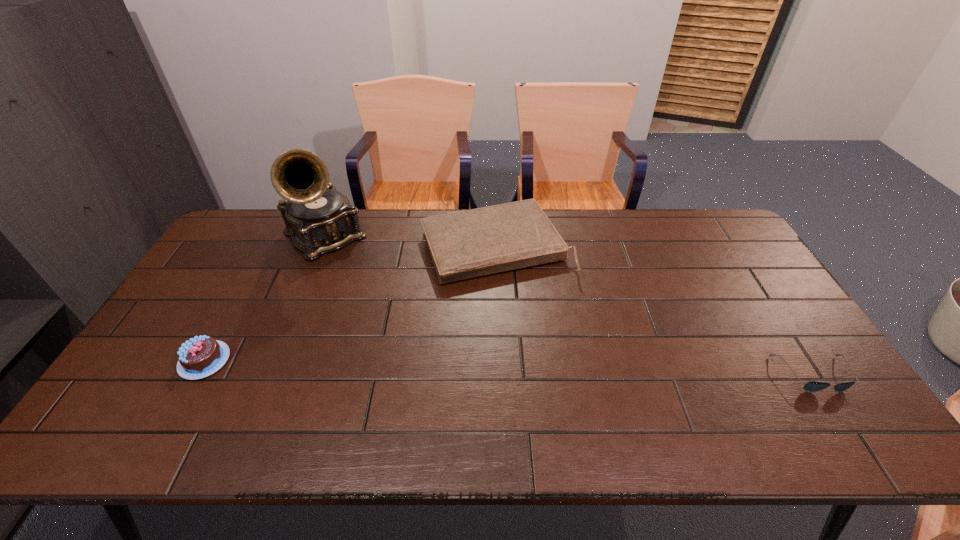
In the image, there is a desktop. What are the coordinates of `free space at the far edge` in the screenshot? It's located at (593, 242).

Locate an element on the screen. This screenshot has height=540, width=960. vacant region at the left edge of the desktop is located at coordinates (202, 307).

In the image, there is a desktop. Identify the location of vacant area at the right edge. (798, 362).

In the image, there is a desktop. Identify the location of free space at the far left corner. (270, 209).

In order to click on vacant space at the near left corner of the desktop in this screenshot , I will do `click(129, 396)`.

The height and width of the screenshot is (540, 960). In order to click on blank space at the near right corner of the desktop in this screenshot , I will do `click(805, 377)`.

Image resolution: width=960 pixels, height=540 pixels. Find the location of `free point between the chocolate cake and the sunglasses`. free point between the chocolate cake and the sunglasses is located at coordinates (509, 367).

Identify the location of free spot between the chocolate cake and the rightmost object. (509, 367).

Locate an element on the screen. free point between the phonograph record and the paperback book is located at coordinates (410, 242).

This screenshot has width=960, height=540. Find the location of `unoccupied position between the shortest object and the paperback book`. unoccupied position between the shortest object and the paperback book is located at coordinates pos(654,310).